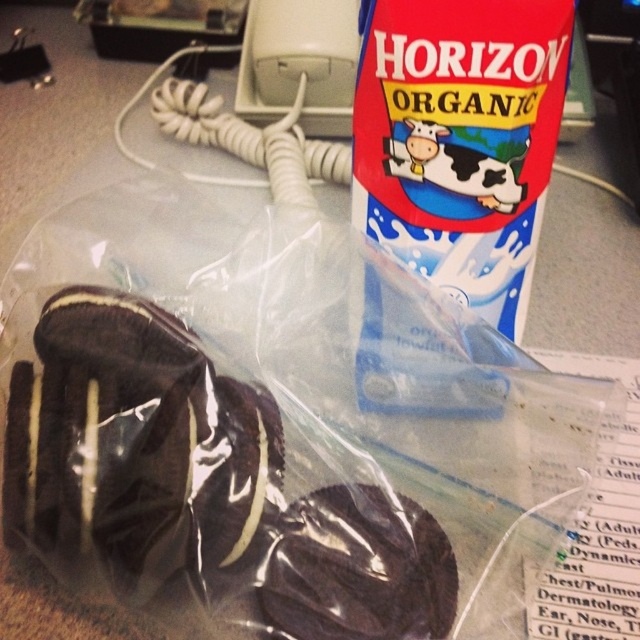
Question: Is chocolate-coated wafer at center smaller than blue paper carton at upper right?

Choices:
 (A) yes
 (B) no

Answer: (A)

Question: Among these objects, which one is farthest from the camera?

Choices:
 (A) blue paper carton at upper right
 (B) chocolate-coated wafer at center

Answer: (A)

Question: Which of the following is the farthest from the observer?

Choices:
 (A) (182, 608)
 (B) (520, 324)

Answer: (B)

Question: Considering the relative positions of chocolate-coated wafer at center and blue paper carton at upper right in the image provided, where is chocolate-coated wafer at center located with respect to blue paper carton at upper right?

Choices:
 (A) right
 (B) left

Answer: (B)

Question: Does chocolate-coated wafer at center have a larger size compared to blue paper carton at upper right?

Choices:
 (A) yes
 (B) no

Answer: (B)